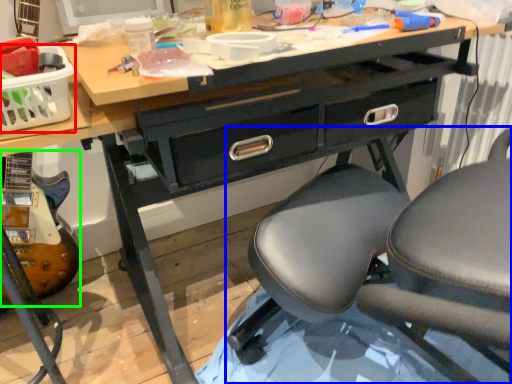
Question: Which object is the closest to the basket (highlighted by a red box)? Choose among these: chair (highlighted by a blue box) or equipment (highlighted by a green box).

Choices:
 (A) chair
 (B) equipment

Answer: (B)